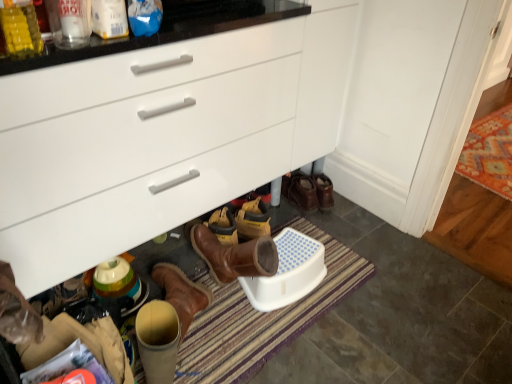
Identify the location of vacant area that lies to the right of white plastic phone at lower center. The width and height of the screenshot is (512, 384). (356, 305).